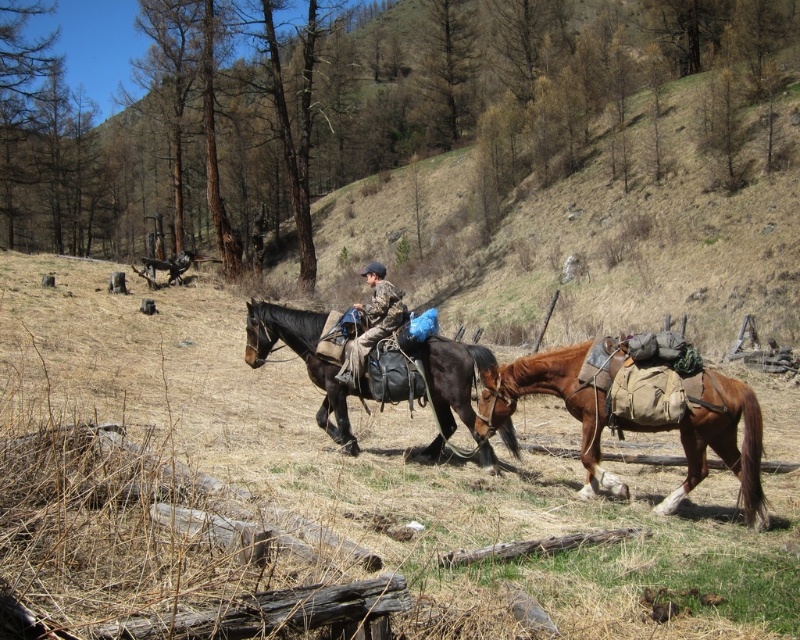
Question: Which object is closer to the camera taking this photo?

Choices:
 (A) brown leather saddle at center
 (B) brown leather horse at right
 (C) camouflage fabric jacket at center

Answer: (B)

Question: Can you confirm if brown leather horse at right is thinner than camouflage fabric jacket at center?

Choices:
 (A) no
 (B) yes

Answer: (A)

Question: Can you confirm if brown leather horse at right is wider than brown leather saddle at center?

Choices:
 (A) yes
 (B) no

Answer: (B)

Question: Estimate the real-world distances between objects in this image. Which object is farther from the brown leather horse at right?

Choices:
 (A) camouflage fabric jacket at center
 (B) brown leather saddle at center

Answer: (A)

Question: Observing the image, what is the correct spatial positioning of brown leather saddle at center in reference to camouflage fabric jacket at center?

Choices:
 (A) below
 (B) above

Answer: (A)

Question: Which object appears farthest from the camera in this image?

Choices:
 (A) camouflage fabric jacket at center
 (B) brown leather saddle at center
 (C) brown leather horse at right

Answer: (A)